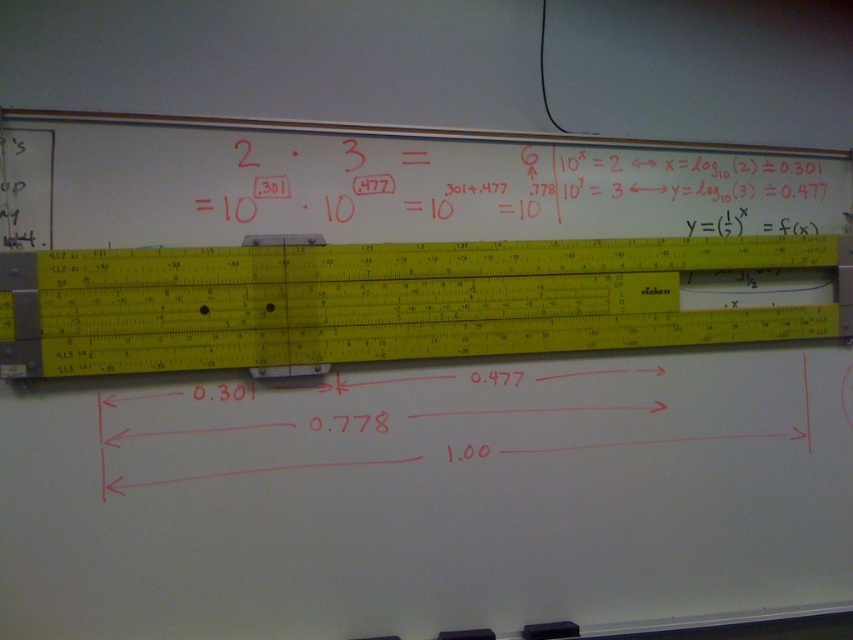
Question: Is the position of yellow plastic ruler at center less distant than that of white chalk math equations at center?

Choices:
 (A) no
 (B) yes

Answer: (B)

Question: Which point is closer to the camera?

Choices:
 (A) (415, 154)
 (B) (258, 314)

Answer: (B)

Question: Where is yellow plastic ruler at center located in relation to white chalk math equations at center in the image?

Choices:
 (A) right
 (B) left

Answer: (B)

Question: Which point is closer to the camera?

Choices:
 (A) white chalk math equations at center
 (B) yellow plastic ruler at center

Answer: (B)

Question: Can you confirm if yellow plastic ruler at center is smaller than white chalk math equations at center?

Choices:
 (A) no
 (B) yes

Answer: (A)

Question: Which of the following is the closest to the observer?

Choices:
 (A) (670, 243)
 (B) (759, 227)

Answer: (A)